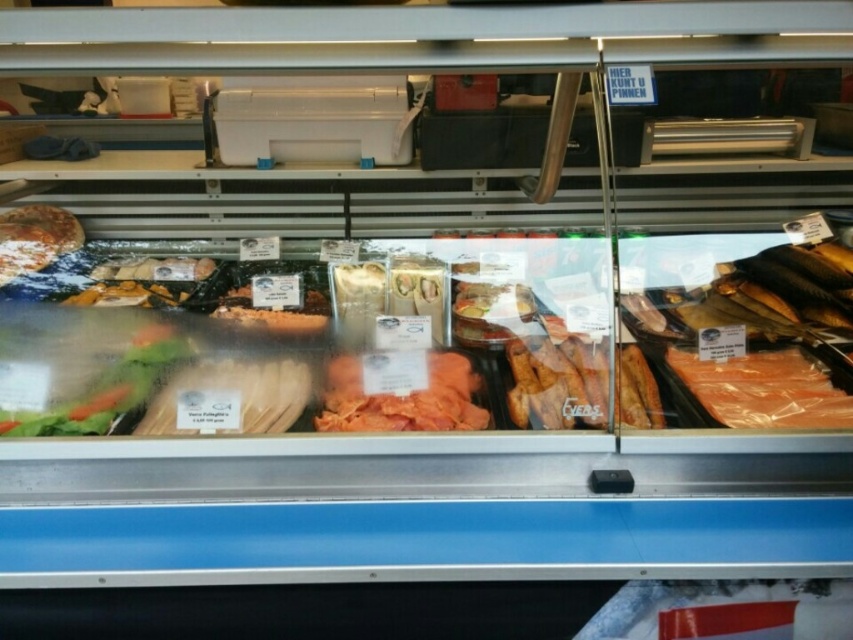
Is pinkish matte salmon at center below shiny brown bread at left?

Correct, pinkish matte salmon at center is located below shiny brown bread at left.

Is pinkish matte salmon at center bigger than shiny brown bread at left?

Correct, pinkish matte salmon at center is larger in size than shiny brown bread at left.

Is point (456, 356) less distant than point (0, 248)?

Yes, it is in front of point (0, 248).

Locate an element on the screen. The image size is (853, 640). pinkish matte salmon at center is located at coordinates (404, 400).

Find the location of a particular element. The image size is (853, 640). pink translucent salmon at right is located at coordinates (763, 388).

Who is more distant from viewer, (x=792, y=380) or (x=479, y=381)?

Point (x=479, y=381)

Locate an element on the screen. This screenshot has height=640, width=853. pink translucent salmon at right is located at coordinates click(x=763, y=388).

Who is positioned more to the left, pink translucent salmon at right or shiny brown bread at left?

shiny brown bread at left is more to the left.

From the picture: Does pink translucent salmon at right have a greater width compared to shiny brown bread at left?

Yes, pink translucent salmon at right is wider than shiny brown bread at left.

Describe the element at coordinates (763, 388) in the screenshot. I see `pink translucent salmon at right` at that location.

Where is `pink translucent salmon at right`? The image size is (853, 640). pink translucent salmon at right is located at coordinates (763, 388).